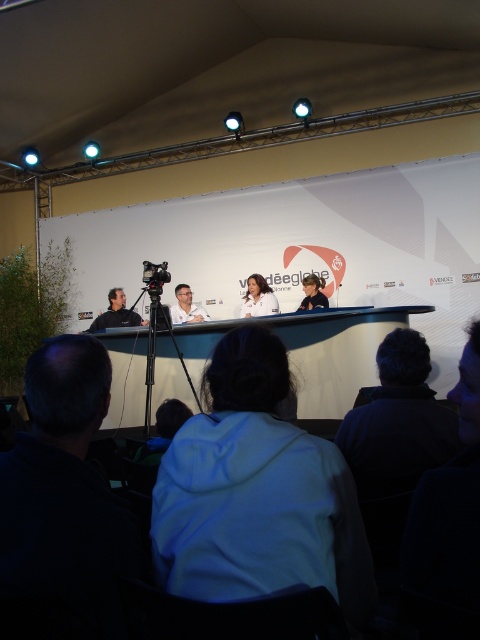
You are a photographer positioned at the back of the stage. You need to capture a clear photo of the white glossy table at center and the matte black shirt at center. Which object will appear larger in your photo?

The white glossy table at center will appear larger in the photo because it is larger in size than the matte black shirt at center.

You are an event photographer positioned at the back of the stage. You need to capture a clear photo of the white glossy table at center without the matte black shirt at center appearing in the frame. Is this possible given their positions?

The white glossy table at center is in front of the matte black shirt at center, so if you position yourself directly facing the table, the shirt will be behind it and not visible in the photo.

You are an event organizer who needs to place a 1.5 meter wide banner on the stage. The banner must be placed on the white glossy table at center or the matte black shirt at center. Which object can accommodate the banner based on their widths?

The white glossy table at center can accommodate the 1.5 meter wide banner since its width surpasses that of the matte black shirt at center.